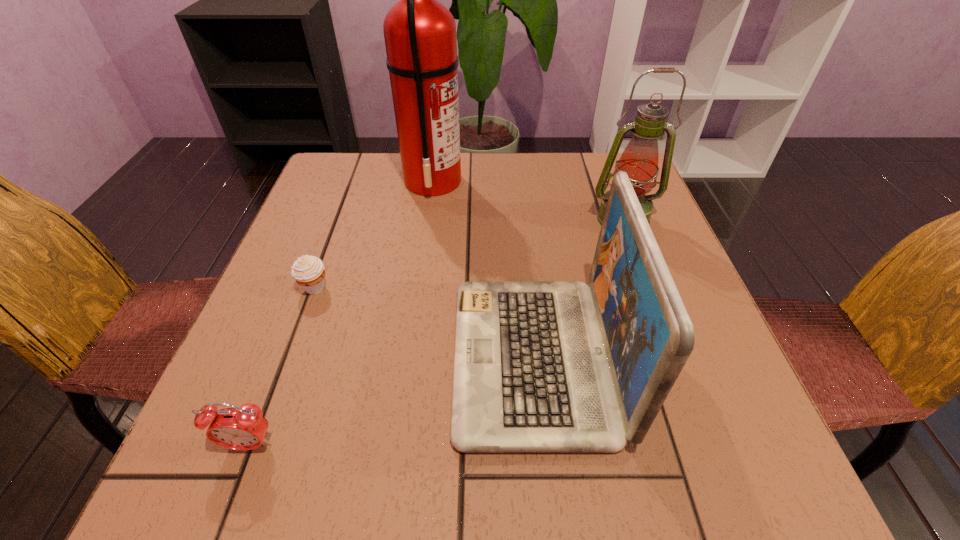
The image size is (960, 540). Identify the location of vacant space located on the screen of the laptop computer. (348, 358).

Where is `free region located 0.110m on the screen of the laptop computer`? free region located 0.110m on the screen of the laptop computer is located at coordinates (390, 358).

The height and width of the screenshot is (540, 960). I want to click on vacant space situated 0.180m on the screen of the laptop computer, so click(x=348, y=358).

Identify the location of vacant space located on the right of the shortest object. (386, 288).

Image resolution: width=960 pixels, height=540 pixels. What are the coordinates of `fire extinguisher located at the far edge` in the screenshot? It's located at (420, 38).

The width and height of the screenshot is (960, 540). I want to click on oil lamp positioned at the far edge, so click(639, 160).

Identify the location of laptop computer present at the near edge. (539, 366).

Find the location of a particular element. The image size is (960, 540). alarm clock positioned at the near edge is located at coordinates (244, 428).

The height and width of the screenshot is (540, 960). Identify the location of alarm clock positioned at the left edge. (244, 428).

Where is `muffin that is positioned at the left edge`? The image size is (960, 540). muffin that is positioned at the left edge is located at coordinates (308, 271).